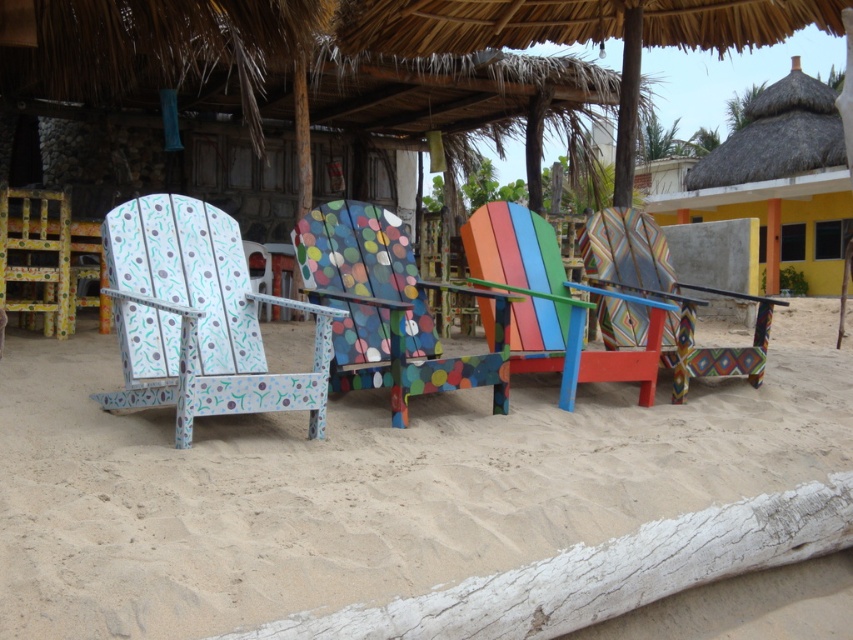
Who is lower down, thatched roof hut at upper right or textured multicolored chair at center?

Positioned lower is textured multicolored chair at center.

Who is more distant from viewer, (x=819, y=128) or (x=672, y=400)?

The point (x=819, y=128) is more distant.

Does point (691, 180) come closer to viewer compared to point (679, 365)?

No, (691, 180) is behind (679, 365).

Where is `thatched roof hut at upper right`? This screenshot has width=853, height=640. thatched roof hut at upper right is located at coordinates (778, 180).

Consider the image. Which of these two, polka dot painted wood chair at center or multicolored painted chair at center, stands shorter?

Standing shorter between the two is polka dot painted wood chair at center.

In the scene shown: Is polka dot painted wood chair at center taller than multicolored painted chair at center?

No.

Where is `polka dot painted wood chair at center`? polka dot painted wood chair at center is located at coordinates (387, 308).

You are a GUI agent. You are given a task and a screenshot of the screen. Output one action in this format:
    pyautogui.click(x=<x>, y=<y>)
    Task: Click on the polka dot painted wood chair at center
    This screenshot has height=640, width=853.
    Given the screenshot: What is the action you would take?
    pyautogui.click(x=387, y=308)

Measure the distance between sandy beach at lower center and polka dot painted wood chair at center.

A distance of 2.29 meters exists between sandy beach at lower center and polka dot painted wood chair at center.

Between sandy beach at lower center and polka dot painted wood chair at center, which one is positioned higher?

polka dot painted wood chair at center is above.

Find the location of a particular element. This screenshot has height=640, width=853. sandy beach at lower center is located at coordinates (368, 484).